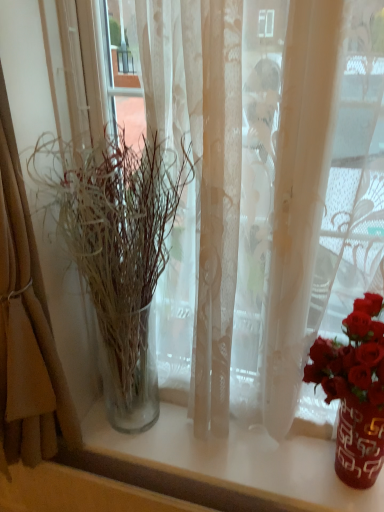
Question: From the image's perspective, is translucent glass vase at left above or below translucent fabric curtain at left?

Choices:
 (A) below
 (B) above

Answer: (A)

Question: Is translucent glass vase at left bigger or smaller than translucent fabric curtain at left?

Choices:
 (A) small
 (B) big

Answer: (A)

Question: From a real-world perspective, is translucent glass vase at left positioned above or below translucent fabric curtain at left?

Choices:
 (A) below
 (B) above

Answer: (A)

Question: In terms of width, does translucent fabric curtain at left look wider or thinner when compared to translucent glass vase at left?

Choices:
 (A) wide
 (B) thin

Answer: (A)

Question: Is translucent fabric curtain at left in front of or behind translucent glass vase at left in the image?

Choices:
 (A) front
 (B) behind

Answer: (A)

Question: Would you say translucent fabric curtain at left is to the left or to the right of translucent glass vase at left in the picture?

Choices:
 (A) right
 (B) left

Answer: (B)

Question: Is translucent fabric curtain at left inside the boundaries of translucent glass vase at left, or outside?

Choices:
 (A) outside
 (B) inside

Answer: (A)